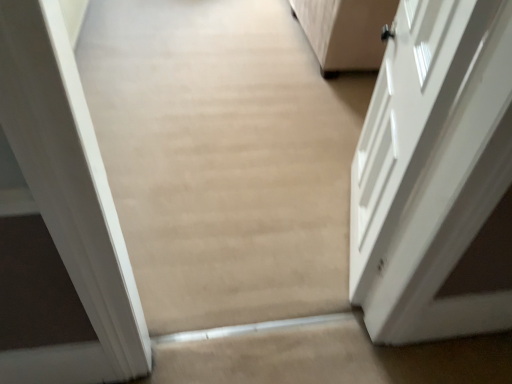
Question: Does beige carpet at center have a lesser height compared to white glossy door at right?

Choices:
 (A) no
 (B) yes

Answer: (A)

Question: Considering the relative positions of beige carpet at center and white glossy door at right in the image provided, is beige carpet at center to the left of white glossy door at right from the viewer's perspective?

Choices:
 (A) no
 (B) yes

Answer: (B)

Question: Is beige carpet at center far from white glossy door at right?

Choices:
 (A) no
 (B) yes

Answer: (A)

Question: Is beige carpet at center positioned before white glossy door at right?

Choices:
 (A) yes
 (B) no

Answer: (A)

Question: Would you say white glossy door at right is part of beige carpet at center's contents?

Choices:
 (A) yes
 (B) no

Answer: (B)

Question: Is beige carpet at center bigger than white glossy door at right?

Choices:
 (A) no
 (B) yes

Answer: (A)

Question: From the image's perspective, would you say white glossy door at right is shown under beige carpet at center?

Choices:
 (A) yes
 (B) no

Answer: (B)

Question: Is white glossy door at right surrounding beige carpet at center?

Choices:
 (A) yes
 (B) no

Answer: (B)

Question: Is white glossy door at right aimed at beige carpet at center?

Choices:
 (A) no
 (B) yes

Answer: (A)

Question: Is white glossy door at right touching beige carpet at center?

Choices:
 (A) no
 (B) yes

Answer: (A)

Question: Does white glossy door at right have a smaller size compared to beige carpet at center?

Choices:
 (A) no
 (B) yes

Answer: (A)

Question: Does white glossy door at right come behind beige carpet at center?

Choices:
 (A) yes
 (B) no

Answer: (A)

Question: In terms of width, does beige carpet at center look wider or thinner when compared to white glossy door at right?

Choices:
 (A) thin
 (B) wide

Answer: (A)